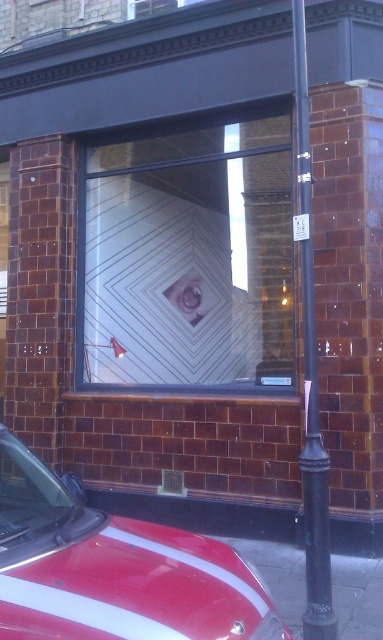
You are standing in front of the storefront and notice two points marked on the window. According to their coordinates, which point is closer to you, point (x=170, y=564) or point (x=114, y=337)?

Point (x=170, y=564) is in front of point (x=114, y=337), so it is closer to you.

You are an interior designer planning to hang a 1.2 meter wide painting. You see the white matte wall at center and the matte white eye at center in the storefront window. Which surface can accommodate the painting without exceeding its width?

The white matte wall at center might be wider than the matte white eye at center, so the white matte wall at center can accommodate the 1.2 meter wide painting if its width is sufficient. The matte white eye at center is likely too narrow.